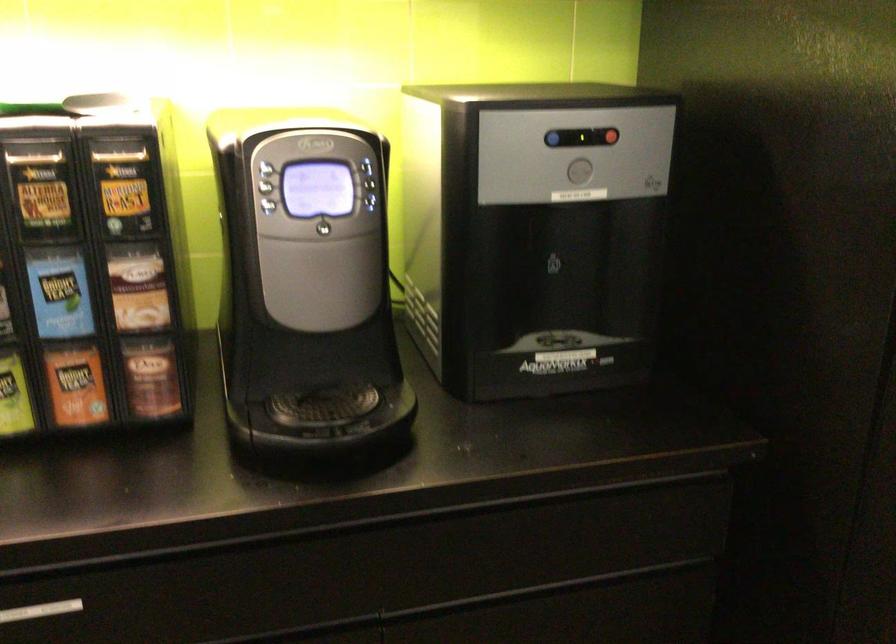
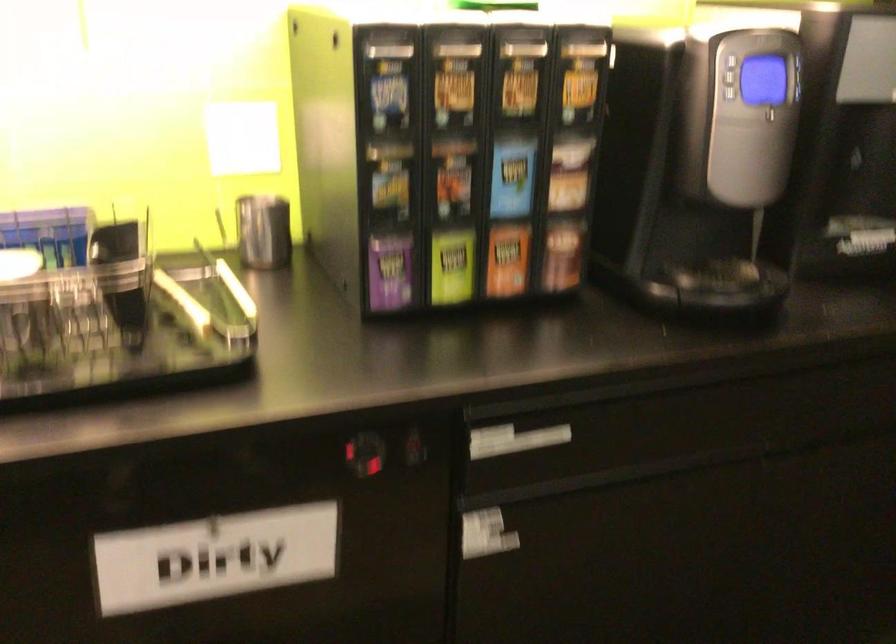
Question: Which direction would the cameraman need to move to produce the second image? Reply with the corresponding letter.

Choices:
 (A) Left
 (B) Right
 (C) Forward
 (D) Backward

Answer: (A)